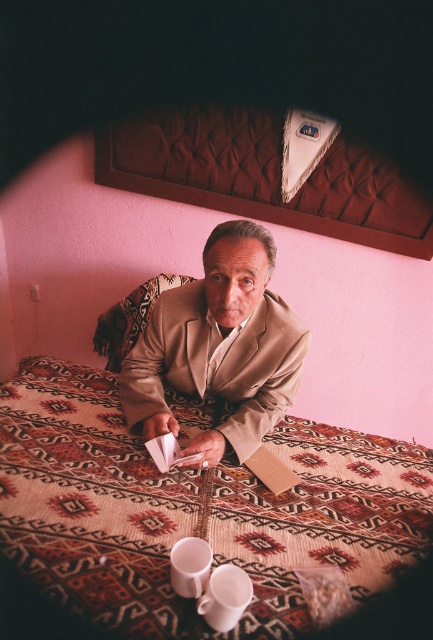
Question: Which point is farther to the camera?

Choices:
 (A) beige fabric suit at center
 (B) white matte cup at lower center

Answer: (A)

Question: Is patterned fabric bed at center wider than white matte cup at lower center?

Choices:
 (A) no
 (B) yes

Answer: (B)

Question: Based on their relative distances, which object is farther from the patterned fabric bed at center?

Choices:
 (A) white matte cup at lower center
 (B) beige fabric at center
 (C) white glossy cup at lower center

Answer: (B)

Question: Can you confirm if beige fabric at center is positioned below white matte cup at lower center?

Choices:
 (A) yes
 (B) no

Answer: (B)

Question: Which of these objects is positioned closest to the beige fabric suit at center?

Choices:
 (A) beige fabric at center
 (B) patterned fabric bed at center
 (C) white matte cup at lower center
 (D) white glossy cup at lower center

Answer: (B)

Question: Is patterned fabric bed at center wider than white glossy cup at lower center?

Choices:
 (A) yes
 (B) no

Answer: (A)